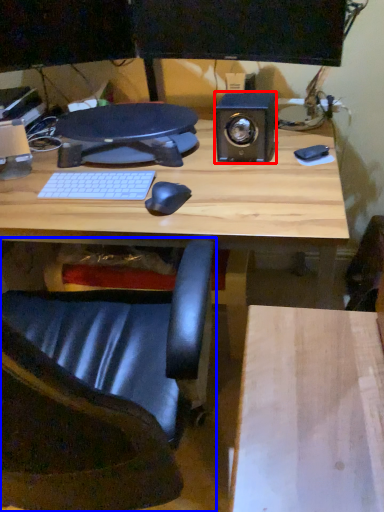
Question: Which point is closer to the camera, speaker (highlighted by a red box) or chair (highlighted by a blue box)?

Choices:
 (A) speaker
 (B) chair

Answer: (B)